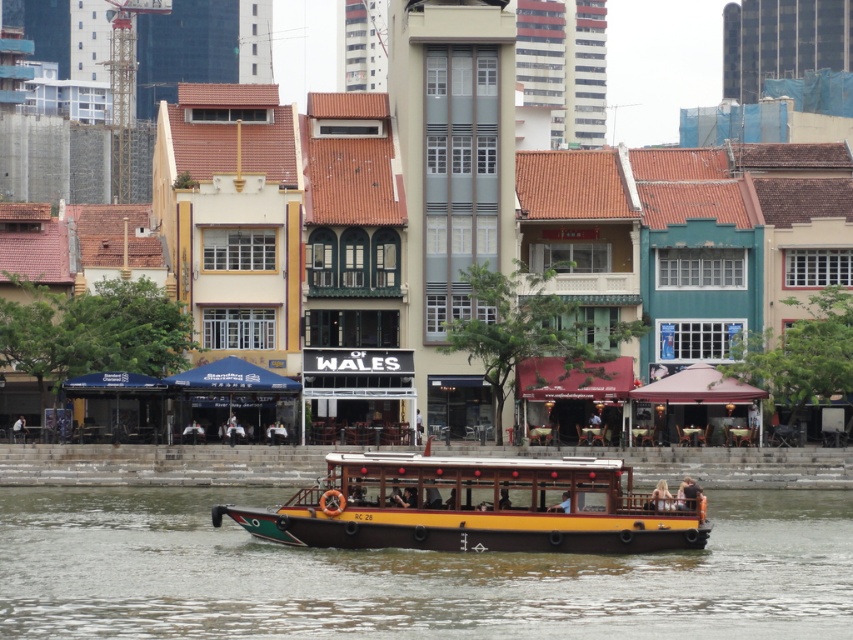
Question: Is yellow wood boat at center positioned before wooden polished boat at center?

Choices:
 (A) yes
 (B) no

Answer: (A)

Question: Which of the following is the farthest from the observer?

Choices:
 (A) wooden polished boat at center
 (B) yellow wood boat at center

Answer: (A)

Question: Can you confirm if yellow wood boat at center is positioned to the right of wooden polished boat at center?

Choices:
 (A) yes
 (B) no

Answer: (B)

Question: Does yellow wood boat at center appear on the left side of wooden polished boat at center?

Choices:
 (A) yes
 (B) no

Answer: (A)